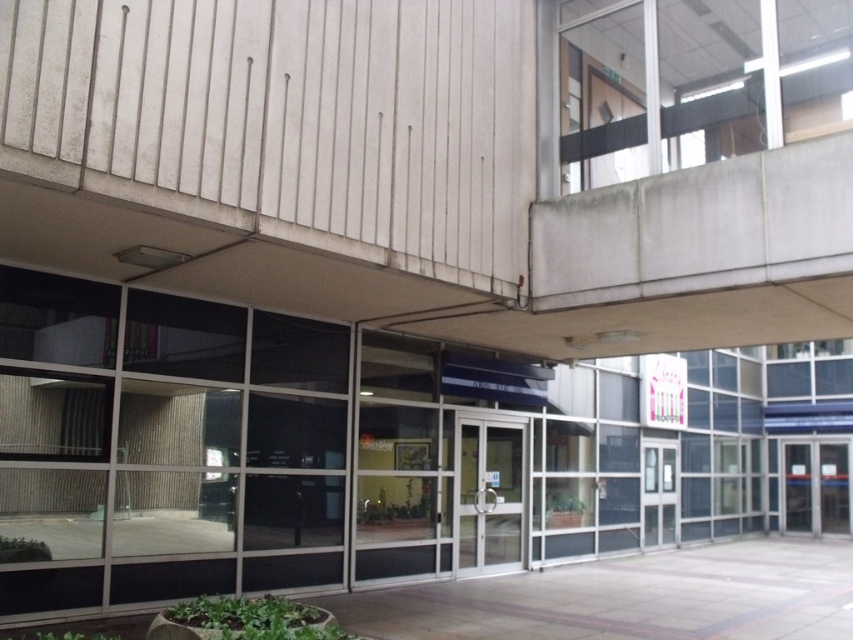
Question: Which point is farther to the camera?

Choices:
 (A) glass door at center
 (B) transparent glass door at center

Answer: (A)

Question: Can you confirm if transparent glass door at center is wider than glass door at center?

Choices:
 (A) no
 (B) yes

Answer: (A)

Question: Is transparent glass door at center positioned at the back of glass door at center?

Choices:
 (A) no
 (B) yes

Answer: (A)

Question: Does transparent glass door at center come behind glass door at center?

Choices:
 (A) yes
 (B) no

Answer: (B)

Question: Which object appears farthest from the camera in this image?

Choices:
 (A) transparent glass door at center
 (B) glass door at center

Answer: (B)